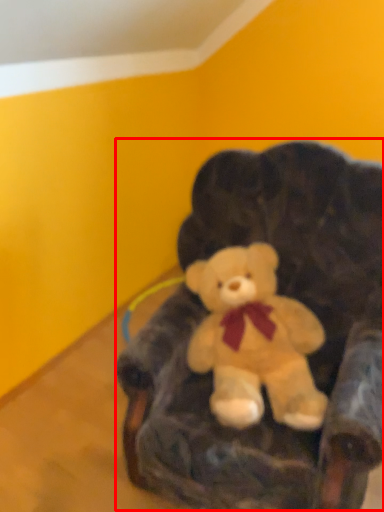
Question: From the image's perspective, where is bean bag chair (annotated by the red box) located relative to teddy bear?

Choices:
 (A) below
 (B) above

Answer: (B)